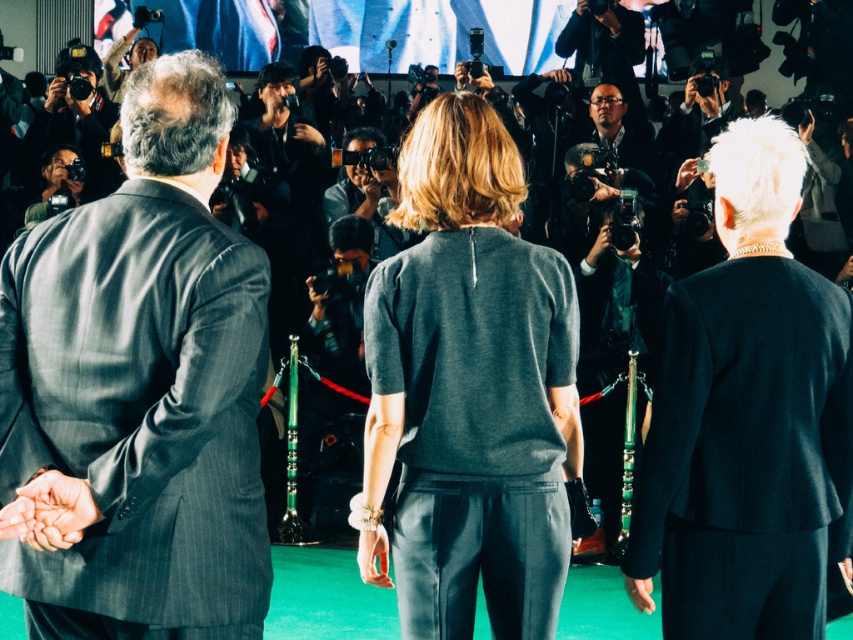
Question: Is dark gray sweater at center below matte black camera at left?

Choices:
 (A) no
 (B) yes

Answer: (B)

Question: Which point appears farthest from the camera in this image?

Choices:
 (A) (387, 193)
 (B) (78, 481)
 (C) (494, 532)

Answer: (A)

Question: Does gray pinstripe suit at left appear over dark gray sweater at center?

Choices:
 (A) no
 (B) yes

Answer: (B)

Question: Which point appears farthest from the camera in this image?

Choices:
 (A) (553, 548)
 (B) (49, 211)
 (C) (349, 188)
 (D) (51, 525)

Answer: (C)

Question: Which point appears closest to the camera in this image?

Choices:
 (A) (743, 486)
 (B) (73, 193)
 (C) (376, 196)

Answer: (A)

Question: Is dark gray sweater at center smaller than matte black camera at center?

Choices:
 (A) yes
 (B) no

Answer: (A)